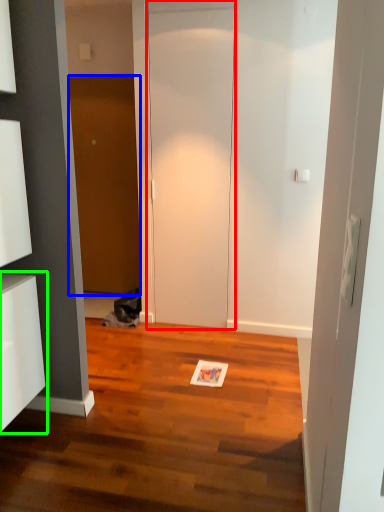
Question: Based on their relative distances, which object is farther from door (highlighted by a red box)? Choose from door (highlighted by a blue box) and cabinetry (highlighted by a green box).

Choices:
 (A) door
 (B) cabinetry

Answer: (B)